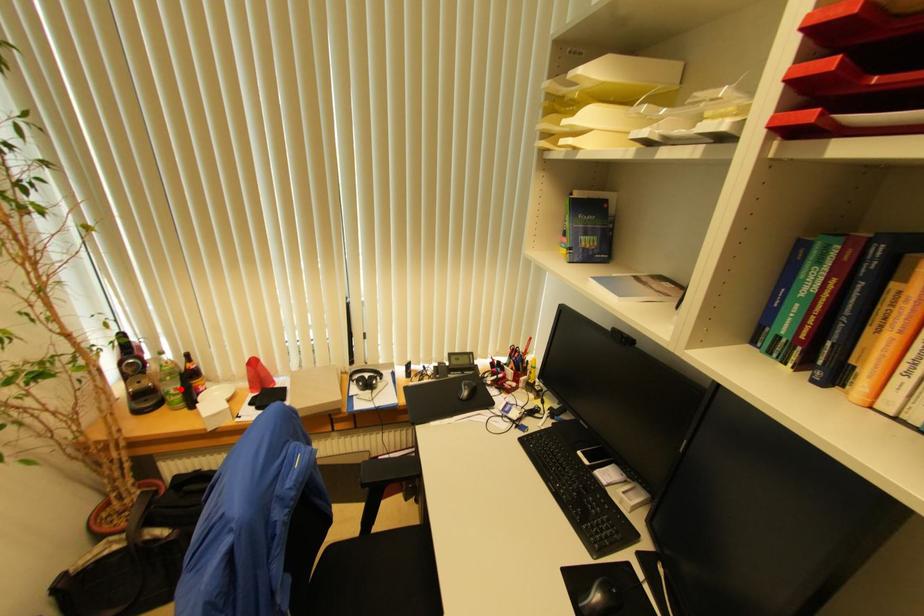
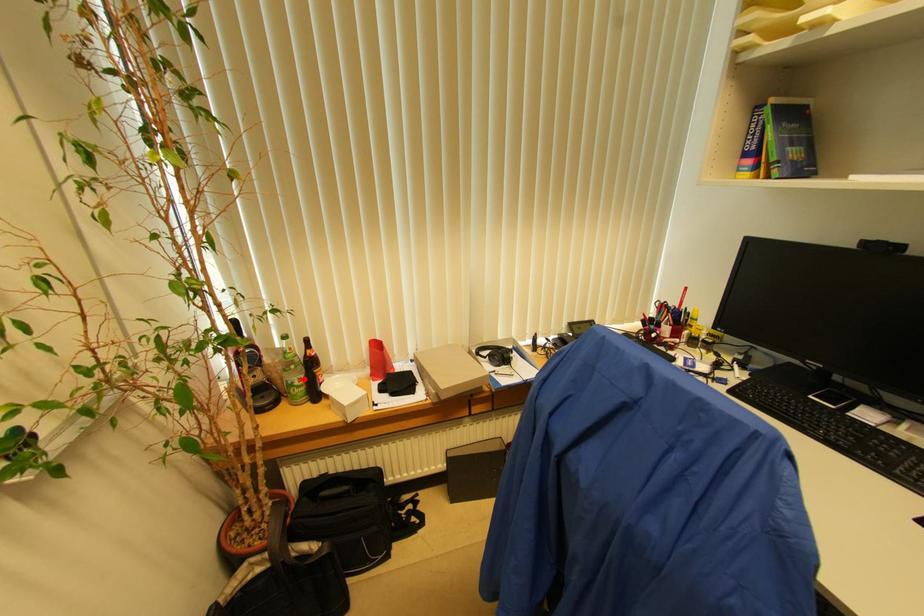
I am providing you with two images of the same scene from different viewpoints. A red point is marked on the first image and another point is marked on the second image. Does the point marked in image1 correspond to the same location as the one in image2?

Yes